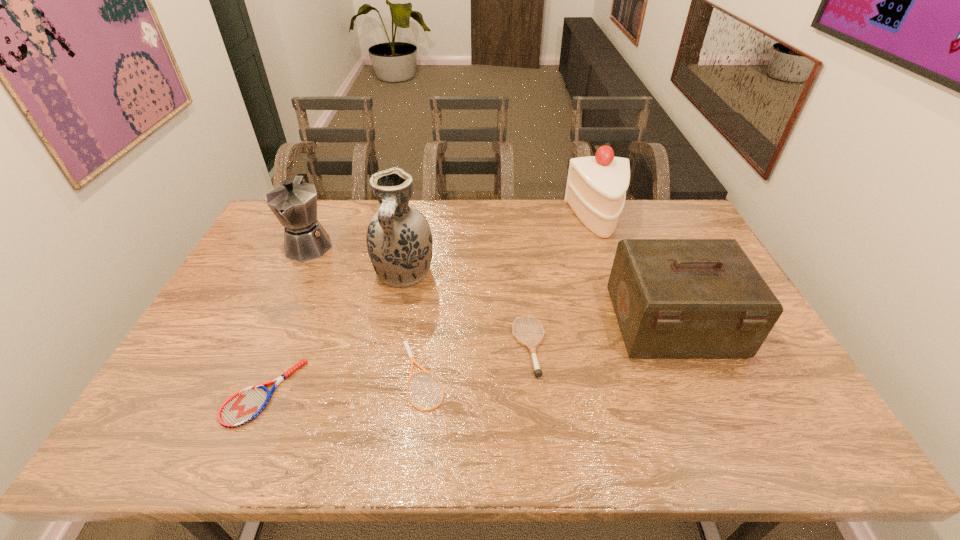
Image resolution: width=960 pixels, height=540 pixels. I want to click on free location located 0.220m on the front of the cake, so click(620, 283).

At what (x,y) coordinates should I click in order to perform the action: click on free space located 0.210m at the spout of the coffeepot. Please return your answer as a coordinate pair (x, y). Looking at the image, I should click on (277, 314).

This screenshot has height=540, width=960. Find the location of `vacant region located 0.360m on the left of the first-aid kit`. vacant region located 0.360m on the left of the first-aid kit is located at coordinates (488, 323).

At what (x,y) coordinates should I click in order to perform the action: click on vacant area situated 0.240m on the left of the rightmost tennis racket. Please return your answer as a coordinate pair (x, y). The height and width of the screenshot is (540, 960). Looking at the image, I should click on (422, 347).

What are the coordinates of `free space located 0.230m on the right of the leftmost tennis racket` in the screenshot? It's located at (393, 393).

Locate an element on the screen. free space located on the right of the second tennis racket from right to left is located at coordinates (609, 376).

Where is `cake that is at the far edge`? The width and height of the screenshot is (960, 540). cake that is at the far edge is located at coordinates (596, 187).

At what (x,y) coordinates should I click in order to perform the action: click on coffeepot that is at the far edge. Please return your answer as a coordinate pair (x, y). Looking at the image, I should click on (294, 203).

At what (x,y) coordinates should I click in order to perform the action: click on object that is at the near edge. Please return your answer as a coordinate pair (x, y). Image resolution: width=960 pixels, height=540 pixels. Looking at the image, I should click on (245, 405).

At what (x,y) coordinates should I click in order to perform the action: click on object that is positioned at the left edge. Please return your answer as a coordinate pair (x, y). Looking at the image, I should click on (294, 203).